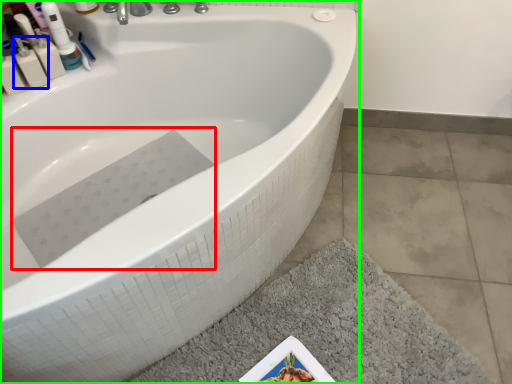
Question: Which is farther away from bath towel (highlighted by a red box)? mouthwash (highlighted by a blue box) or bathtub (highlighted by a green box)?

Choices:
 (A) mouthwash
 (B) bathtub

Answer: (A)